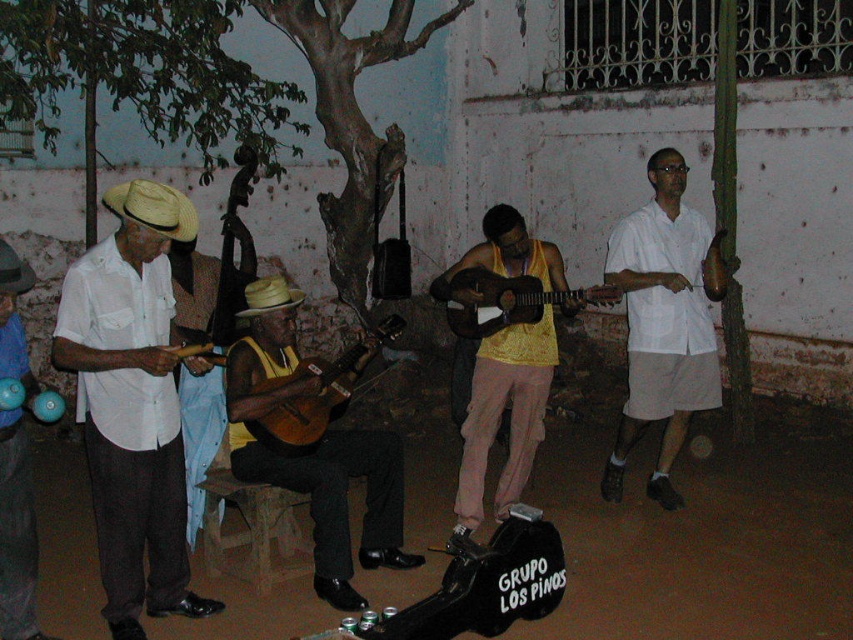
Question: Does matte white shirt at left appear under wooden acoustic guitar at center?

Choices:
 (A) yes
 (B) no

Answer: (A)

Question: Does matte straw hat at left have a lesser width compared to acoustic wood guitar at center?

Choices:
 (A) no
 (B) yes

Answer: (B)

Question: Does matte straw hat at left appear on the left side of acoustic wood guitar at center?

Choices:
 (A) no
 (B) yes

Answer: (B)

Question: Which point is farther to the camera?

Choices:
 (A) (322, 362)
 (B) (219, 262)

Answer: (B)

Question: Which object is the farthest from the matte yellow tank top at center?

Choices:
 (A) acoustic wood guitar at center
 (B) matte white shirt at left
 (C) yellow matte tank top at center
 (D) matte straw hat at left

Answer: (D)

Question: Which of the following is the farthest from the observer?

Choices:
 (A) (456, 326)
 (B) (608, 248)

Answer: (B)